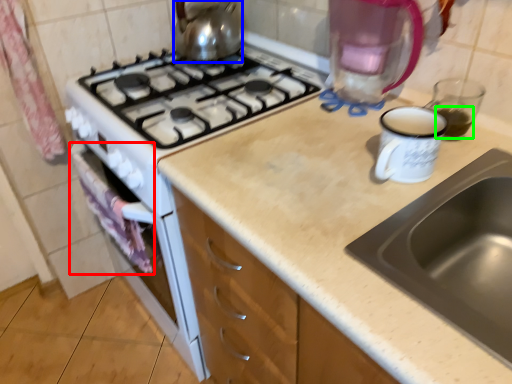
Question: Estimate the real-world distances between objects in this image. Which object is farther from cloth (highlighted by a red box), kitchen appliance (highlighted by a blue box) or beverage (highlighted by a green box)?

Choices:
 (A) kitchen appliance
 (B) beverage

Answer: (B)